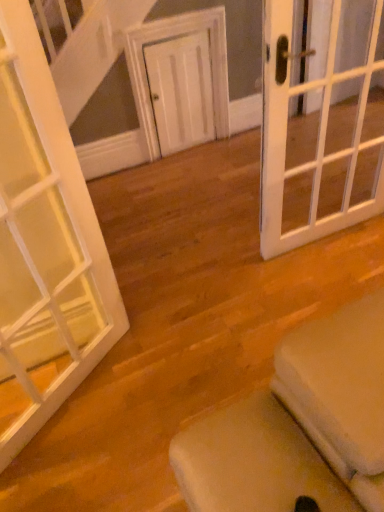
Question: Does white matte door at center, which is the third door from front to back, have a smaller size compared to white glass door at left, positioned as the third door in right-to-left order?

Choices:
 (A) no
 (B) yes

Answer: (B)

Question: Can you confirm if white matte door at center, positioned as the 2th door in right-to-left order, is taller than white glass door at left, which is counted as the third door, starting from the back?

Choices:
 (A) no
 (B) yes

Answer: (A)

Question: Is white matte door at center, which is the third door from front to back, positioned beyond the bounds of white glass door at left, positioned as the third door in right-to-left order?

Choices:
 (A) no
 (B) yes

Answer: (B)

Question: From a real-world perspective, is white matte door at center, positioned as the 2th door in right-to-left order, located beneath white glass door at left, positioned as the third door in right-to-left order?

Choices:
 (A) yes
 (B) no

Answer: (A)

Question: Is white matte door at center, which is the third door from front to back, in front of white glass door at left, which is counted as the third door, starting from the back?

Choices:
 (A) yes
 (B) no

Answer: (B)

Question: Is white glass door at left, arranged as the 1th door when viewed from the left, in front of or behind white matte door at center, placed as the 2th door when sorted from left to right, in the image?

Choices:
 (A) behind
 (B) front

Answer: (B)

Question: Considering the positions of white glass door at left, which is counted as the third door, starting from the back, and white matte door at center, which is counted as the 1th door, starting from the back, in the image, is white glass door at left, which is counted as the third door, starting from the back, taller or shorter than white matte door at center, which is counted as the 1th door, starting from the back,?

Choices:
 (A) short
 (B) tall

Answer: (B)

Question: Considering the relative positions of white glass door at left, positioned as the third door in right-to-left order, and white matte door at center, positioned as the 2th door in right-to-left order, in the image provided, is white glass door at left, positioned as the third door in right-to-left order, to the left or to the right of white matte door at center, positioned as the 2th door in right-to-left order,?

Choices:
 (A) right
 (B) left

Answer: (B)

Question: Is point (82, 367) closer or farther from the camera than point (162, 142)?

Choices:
 (A) closer
 (B) farther

Answer: (A)

Question: Is white glass door at left, positioned as the third door in right-to-left order, bigger or smaller than white glass door at right, positioned as the 2th door in front-to-back order?

Choices:
 (A) big
 (B) small

Answer: (A)

Question: From a real-world perspective, is white glass door at left, which is counted as the 1th door, starting from the front, physically located above or below white glass door at right, which is the third door from left to right?

Choices:
 (A) above
 (B) below

Answer: (A)

Question: Is white glass door at left, which is counted as the third door, starting from the back, in front of or behind white glass door at right, which is the 1th door in right-to-left order, in the image?

Choices:
 (A) behind
 (B) front

Answer: (B)

Question: In terms of height, does white glass door at left, which is counted as the 1th door, starting from the front, look taller or shorter compared to white glass door at right, the 2th door from the back?

Choices:
 (A) tall
 (B) short

Answer: (A)

Question: Do you think white glass door at right, positioned as the 2th door in front-to-back order, is within white glass door at left, which is counted as the 1th door, starting from the front, or outside of it?

Choices:
 (A) outside
 (B) inside

Answer: (A)

Question: Is white glass door at right, which is the third door from left to right, to the left or to the right of white glass door at left, which is counted as the third door, starting from the back, in the image?

Choices:
 (A) right
 (B) left

Answer: (A)